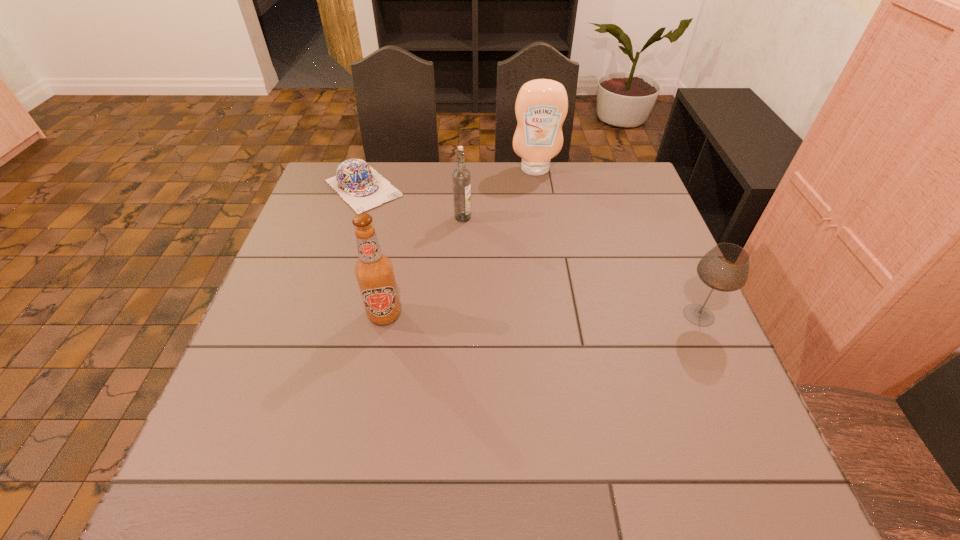
Locate an element on the screen. The height and width of the screenshot is (540, 960). beer bottle is located at coordinates (374, 271).

Locate an element on the screen. The image size is (960, 540). wineglass is located at coordinates point(725,267).

Where is `the fourth tallest object`? the fourth tallest object is located at coordinates (725, 267).

At what (x,y) coordinates should I click in order to perform the action: click on the third object from left to right. Please return your answer as a coordinate pair (x, y). The height and width of the screenshot is (540, 960). Looking at the image, I should click on pos(461,177).

Find the location of a particular element. the third shortest object is located at coordinates 461,177.

At what (x,y) coordinates should I click in order to perform the action: click on the second object from right to left. Please return your answer as a coordinate pair (x, y). Looking at the image, I should click on (541, 106).

This screenshot has height=540, width=960. Identify the location of the shortest object. (363, 188).

Locate an element on the screen. This screenshot has width=960, height=540. free space located 0.060m on the front label of the beer bottle is located at coordinates coord(377,352).

The width and height of the screenshot is (960, 540). Find the location of `vacant space located on the left of the wineglass`. vacant space located on the left of the wineglass is located at coordinates (564, 315).

Identify the location of vacant space situated 0.180m on the label of the third object from left to right. (511, 256).